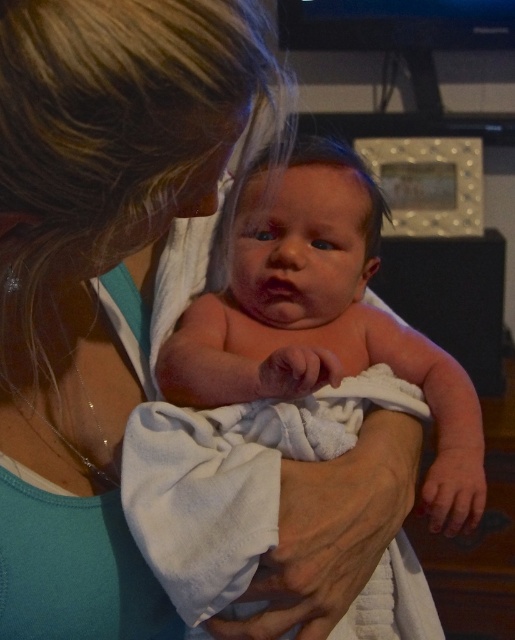
Consider the image. You are a caregiver holding a baby wrapped in the pink soft towel at center. You need to place the baby on the blue fabric at center. Can you safely place the baby there if the minimum safe distance required is 8 inches?

The distance between the blue fabric at center and pink soft towel at center is 6.48 inches, which is less than the required 8 inches. Therefore, placing the baby there would not meet the safety requirement.

You are a parent trying to decide which item to use for wrapping your baby. You have a blue fabric at center and a pink soft towel at center. Based on their sizes, which one would be more suitable for covering the baby comfortably?

The pink soft towel at center is taller than the blue fabric at center, making it more suitable for comfortably covering the baby.

You are helping to dress a baby and have two options for a blanket. The blue fabric at center and the pink soft towel at center are both available. The baby needs a thicker material for warmth. Which one should you choose?

The pink soft towel at center is thicker than the blue fabric at center, so you should choose the pink soft towel at center for the baby.